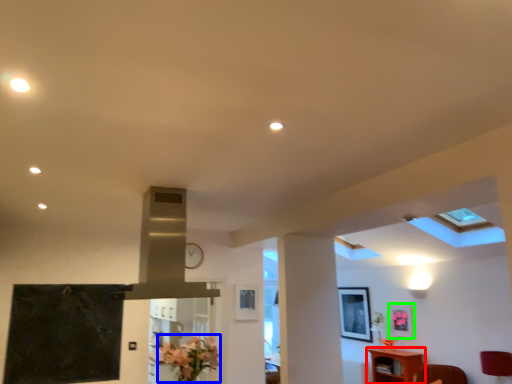
Question: Considering the real-world distances, which object is farthest from furniture (highlighted by a red box)? flower (highlighted by a blue box) or picture frame (highlighted by a green box)?

Choices:
 (A) flower
 (B) picture frame

Answer: (A)